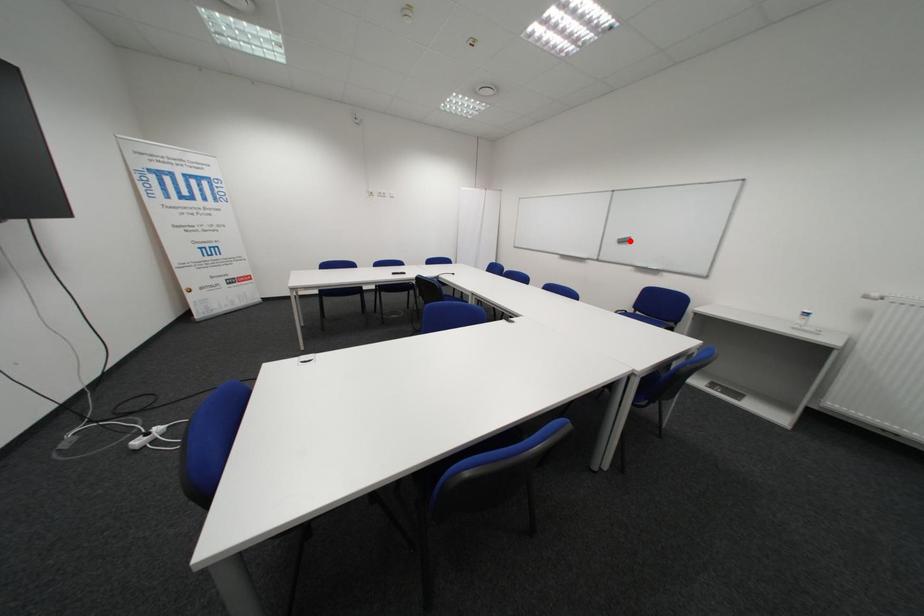
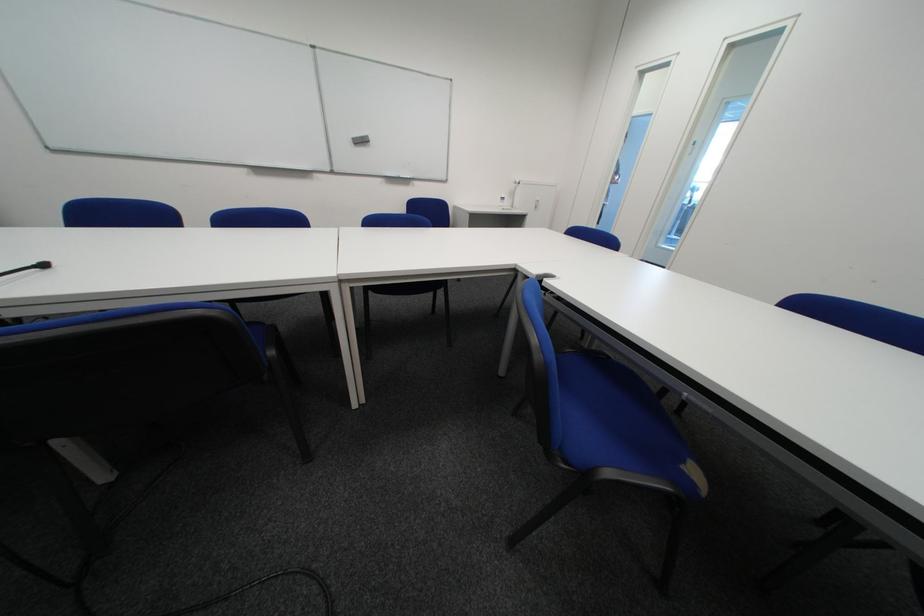
Question: I am providing you with two images of the same scene from different viewpoints. Given a red point in image1, look at the same physical point in image2. Is it:

Choices:
 (A) Closer to the viewpoint
 (B) Farther from the viewpoint

Answer: (A)